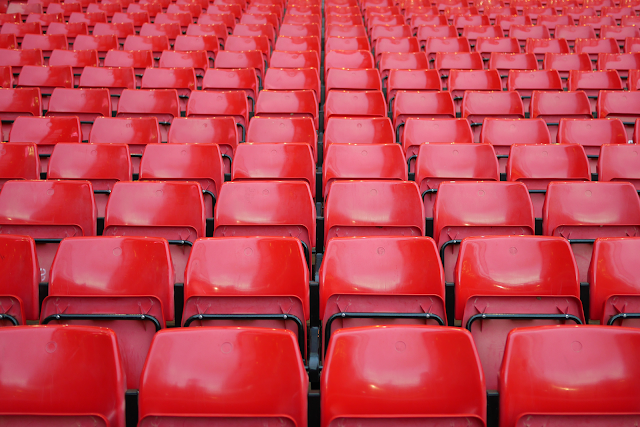
The image size is (640, 427). I want to click on red chairs in the second row, so (15, 263), (116, 261), (208, 261), (360, 264), (468, 265), (608, 268).